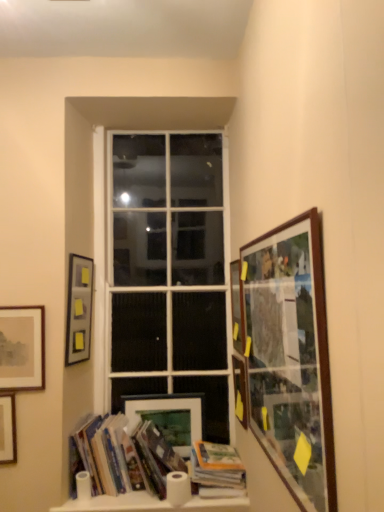
Question: Should I look upward or downward to see matte glass picture frame at right, acting as the second picture frame starting from the right?

Choices:
 (A) up
 (B) down

Answer: (B)

Question: Does matte wooden picture frame at lower center, acting as the 4th picture frame starting from the left, have a lesser height compared to wooden picture frame at right, placed as the third picture frame when sorted from right to left?

Choices:
 (A) no
 (B) yes

Answer: (B)

Question: Is matte wooden picture frame at lower center, acting as the 4th picture frame starting from the right, further to the viewer compared to wooden picture frame at right, placed as the third picture frame when sorted from right to left?

Choices:
 (A) no
 (B) yes

Answer: (B)

Question: From the image's perspective, is matte wooden picture frame at lower center, acting as the 4th picture frame starting from the right, under wooden picture frame at right, the fifth picture frame positioned from the left?

Choices:
 (A) yes
 (B) no

Answer: (A)

Question: Does matte wooden picture frame at lower center, acting as the 4th picture frame starting from the left, have a larger size compared to wooden picture frame at right, placed as the third picture frame when sorted from right to left?

Choices:
 (A) no
 (B) yes

Answer: (A)

Question: Is matte wooden picture frame at lower center, acting as the 4th picture frame starting from the left, to the left of wooden picture frame at right, placed as the third picture frame when sorted from right to left, from the viewer's perspective?

Choices:
 (A) yes
 (B) no

Answer: (A)

Question: Can you confirm if matte wooden picture frame at lower center, acting as the 4th picture frame starting from the left, is positioned to the right of wooden picture frame at right, the fifth picture frame positioned from the left?

Choices:
 (A) yes
 (B) no

Answer: (B)

Question: Is hardcover books at lower left, placed as the second book when sorted from right to left, closer to camera compared to white matte toilet paper at lower left, the second toilet paper when ordered from right to left?

Choices:
 (A) yes
 (B) no

Answer: (A)

Question: Can you confirm if hardcover books at lower left, placed as the second book when sorted from right to left, is wider than white matte toilet paper at lower left, the second toilet paper when ordered from right to left?

Choices:
 (A) no
 (B) yes

Answer: (B)

Question: From a real-world perspective, does hardcover books at lower left, which is the first book from left to right, sit lower than white matte toilet paper at lower left, the second toilet paper when ordered from right to left?

Choices:
 (A) no
 (B) yes

Answer: (A)

Question: From the image's perspective, would you say hardcover books at lower left, placed as the second book when sorted from right to left, is positioned over white matte toilet paper at lower left, the second toilet paper when ordered from right to left?

Choices:
 (A) yes
 (B) no

Answer: (A)

Question: Is hardcover books at lower left, placed as the second book when sorted from right to left, outside white matte toilet paper at lower left, which ranks as the 1th toilet paper in left-to-right order?

Choices:
 (A) no
 (B) yes

Answer: (B)

Question: From a real-world perspective, does hardcover books at lower left, which is the first book from left to right, stand above white matte toilet paper at lower left, which ranks as the 1th toilet paper in left-to-right order?

Choices:
 (A) no
 (B) yes

Answer: (B)

Question: Can we say white matte toilet paper at lower left, the second toilet paper when ordered from right to left, lies outside matte glass picture frame at right, marked as the sixth picture frame in a left-to-right arrangement?

Choices:
 (A) yes
 (B) no

Answer: (A)